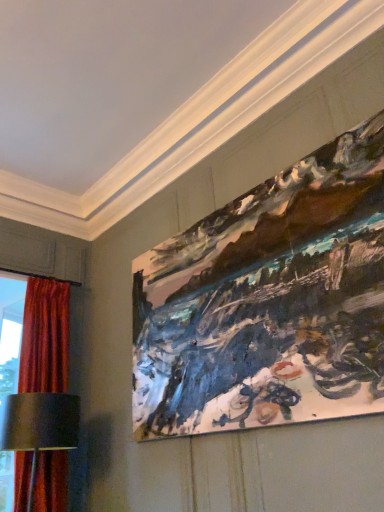
Question: Is the position of metallic silver table lamp at lower left less distant than that of velvet red curtain at left?

Choices:
 (A) no
 (B) yes

Answer: (B)

Question: Is metallic silver table lamp at lower left not inside velvet red curtain at left?

Choices:
 (A) yes
 (B) no

Answer: (A)

Question: Considering the relative sizes of metallic silver table lamp at lower left and velvet red curtain at left in the image provided, is metallic silver table lamp at lower left smaller than velvet red curtain at left?

Choices:
 (A) yes
 (B) no

Answer: (A)

Question: Is metallic silver table lamp at lower left facing away from velvet red curtain at left?

Choices:
 (A) no
 (B) yes

Answer: (A)

Question: Can you confirm if metallic silver table lamp at lower left is bigger than velvet red curtain at left?

Choices:
 (A) no
 (B) yes

Answer: (A)

Question: Is metallic silver table lamp at lower left not close to velvet red curtain at left?

Choices:
 (A) yes
 (B) no

Answer: (B)

Question: From the image's perspective, is velvet red curtain at left located beneath metallic silver table lamp at lower left?

Choices:
 (A) no
 (B) yes

Answer: (A)

Question: Could you tell me if velvet red curtain at left is turned towards metallic silver table lamp at lower left?

Choices:
 (A) no
 (B) yes

Answer: (B)

Question: Is velvet red curtain at left smaller than metallic silver table lamp at lower left?

Choices:
 (A) yes
 (B) no

Answer: (B)

Question: Does velvet red curtain at left have a greater height compared to metallic silver table lamp at lower left?

Choices:
 (A) no
 (B) yes

Answer: (B)

Question: From a real-world perspective, is velvet red curtain at left physically above metallic silver table lamp at lower left?

Choices:
 (A) no
 (B) yes

Answer: (B)

Question: Is velvet red curtain at left shorter than metallic silver table lamp at lower left?

Choices:
 (A) yes
 (B) no

Answer: (B)

Question: From the image's perspective, is painted canvas at upper right on velvet red curtain at left?

Choices:
 (A) no
 (B) yes

Answer: (B)